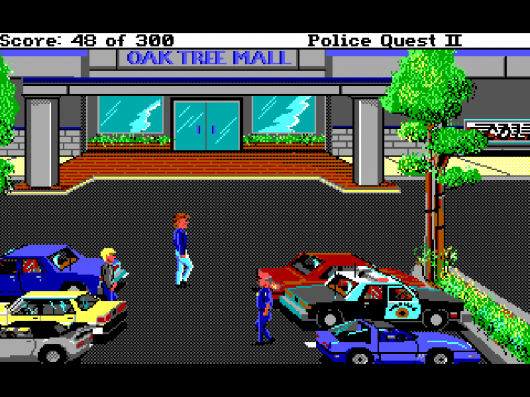
In order to click on double doors in this screenshot , I will do `click(212, 119)`, `click(195, 118)`.